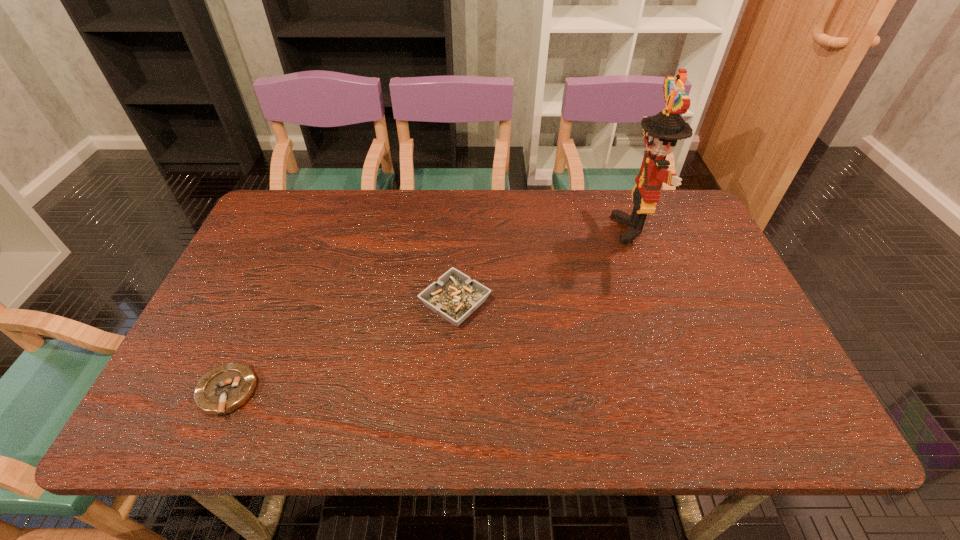
You are a GUI agent. You are given a task and a screenshot of the screen. Output one action in this format:
    pyautogui.click(x=<x>, y=<y>)
    Task: Click on the free region located 0.170m on the back of the nearer ashtray
    
    Given the screenshot: What is the action you would take?
    pyautogui.click(x=264, y=308)

The height and width of the screenshot is (540, 960). In order to click on object that is at the far edge in this screenshot , I will do `click(661, 132)`.

Locate an element on the screen. Image resolution: width=960 pixels, height=540 pixels. object that is at the near edge is located at coordinates (224, 389).

I want to click on object situated at the left edge, so click(x=224, y=389).

Image resolution: width=960 pixels, height=540 pixels. In order to click on object that is at the right edge in this screenshot , I will do `click(661, 132)`.

Find the location of `object present at the near left corner`. object present at the near left corner is located at coordinates (224, 389).

Image resolution: width=960 pixels, height=540 pixels. Identify the location of object that is positioned at the far right corner. (661, 132).

Locate an element on the screen. This screenshot has height=540, width=960. vacant space at the far edge of the desktop is located at coordinates (497, 191).

The image size is (960, 540). Identify the location of blank space at the near edge of the desktop. [x=534, y=420].

Identify the location of vacant space at the left edge of the desktop. (276, 301).